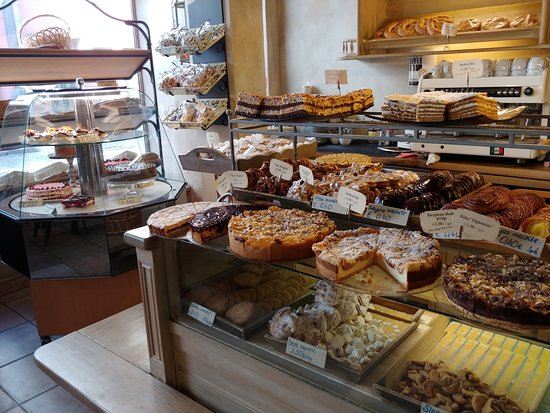
This screenshot has width=550, height=413. Identify the location of glass round case. (87, 110).